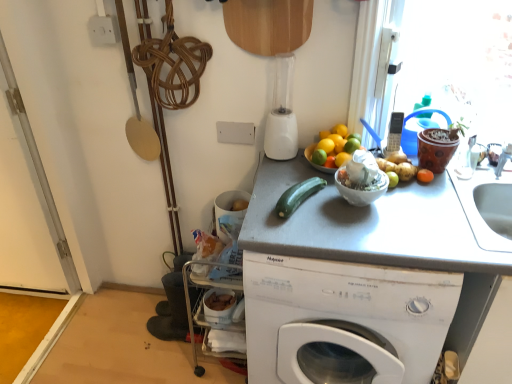
Question: Can you confirm if white matte washing machine at center is thinner than gray matte counter top at center?

Choices:
 (A) no
 (B) yes

Answer: (A)

Question: Does white matte washing machine at center have a smaller size compared to gray matte counter top at center?

Choices:
 (A) yes
 (B) no

Answer: (A)

Question: From a real-world perspective, is white matte washing machine at center below gray matte counter top at center?

Choices:
 (A) no
 (B) yes

Answer: (B)

Question: Is white matte washing machine at center not inside gray matte counter top at center?

Choices:
 (A) no
 (B) yes

Answer: (A)

Question: Does white matte washing machine at center appear on the right side of gray matte counter top at center?

Choices:
 (A) no
 (B) yes

Answer: (A)

Question: Is green matte lime at upper right, which is the second lime from left to right, inside or outside of white matte washing machine at center?

Choices:
 (A) inside
 (B) outside

Answer: (B)

Question: Based on their positions, is green matte lime at upper right, which is the second lime from left to right, located to the left or right of white matte washing machine at center?

Choices:
 (A) left
 (B) right

Answer: (B)

Question: In terms of width, does green matte lime at upper right, the 1th lime in the right-to-left sequence, look wider or thinner when compared to white matte washing machine at center?

Choices:
 (A) thin
 (B) wide

Answer: (A)

Question: Is point (352, 150) positioned closer to the camera than point (371, 360)?

Choices:
 (A) farther
 (B) closer

Answer: (A)

Question: Based on their sizes in the image, would you say white matte washing machine at center is bigger or smaller than gray matte counter top at center?

Choices:
 (A) big
 (B) small

Answer: (B)

Question: From a real-world perspective, is white matte washing machine at center positioned above or below gray matte counter top at center?

Choices:
 (A) below
 (B) above

Answer: (A)

Question: Is white matte washing machine at center to the left or to the right of gray matte counter top at center in the image?

Choices:
 (A) right
 (B) left

Answer: (B)

Question: Relative to gray matte counter top at center, is white matte washing machine at center in front or behind?

Choices:
 (A) behind
 (B) front

Answer: (A)

Question: Based on their positions, is gray matte counter top at center located to the left or right of green smooth-textured zucchini at center?

Choices:
 (A) right
 (B) left

Answer: (A)

Question: Is gray matte counter top at center in front of or behind green smooth-textured zucchini at center in the image?

Choices:
 (A) front
 (B) behind

Answer: (A)